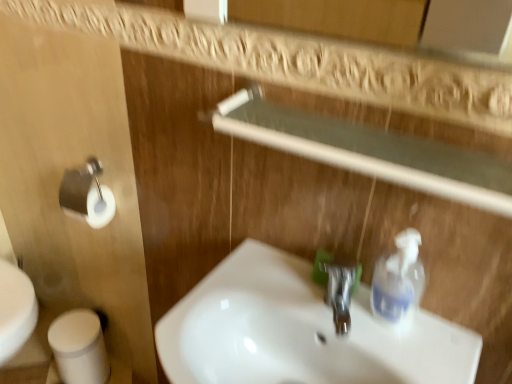
Question: Is transparent glass balustrade at upper center wider or thinner than white matte toilet paper at lower left?

Choices:
 (A) wide
 (B) thin

Answer: (B)

Question: Would you say transparent glass balustrade at upper center is to the left or to the right of white matte toilet paper at lower left in the picture?

Choices:
 (A) left
 (B) right

Answer: (B)

Question: Considering the real-world distances, which object is closest to the white glossy sink at center?

Choices:
 (A) transparent glass balustrade at upper center
 (B) clear plastic soap dispenser at right
 (C) polished chrome faucet at center
 (D) white matte toilet paper at lower left

Answer: (C)

Question: Based on their relative distances, which object is farther from the polished chrome faucet at center?

Choices:
 (A) clear plastic soap dispenser at right
 (B) white matte toilet paper at lower left
 (C) white glossy sink at center
 (D) transparent glass balustrade at upper center

Answer: (B)